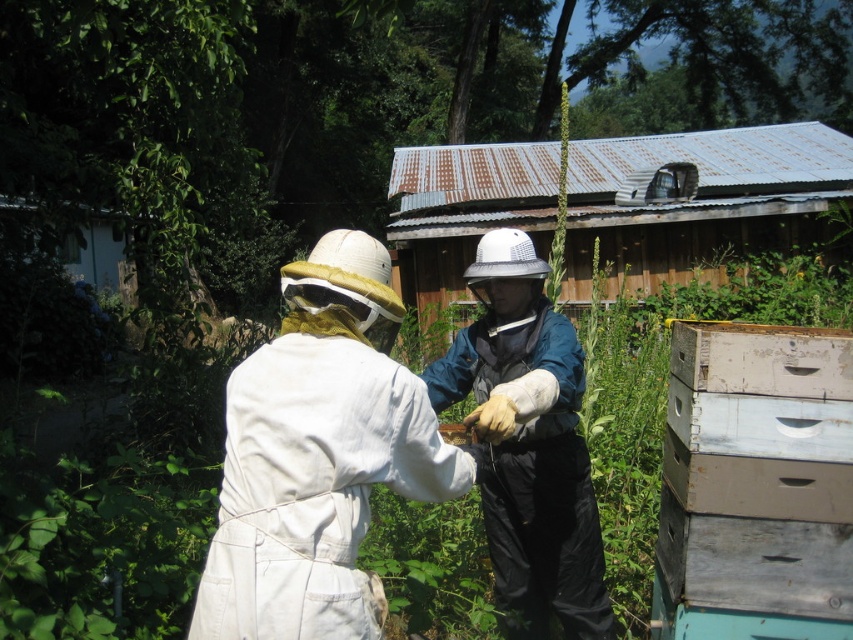
Please provide the exact coordinates of the white cotton beekeeper suit at center in the image.

The white cotton beekeeper suit at center is located at coordinates point (318,456).

You are a new beekeeper standing in the field. You see the white cotton beekeeper suit at center and the weathered wood beehive at right. Which object is positioned more to the east?

The weathered wood beehive at right is positioned more to the east because the white cotton beekeeper suit at center is to the left of it.